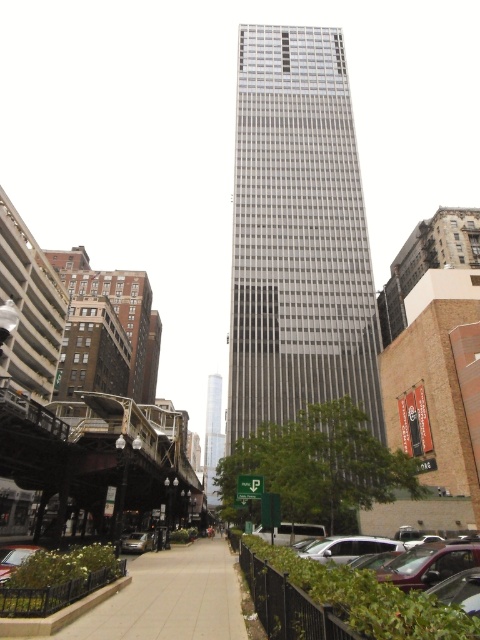
Question: Which object appears farthest from the camera in this image?

Choices:
 (A) silver glass skyscraper at center
 (B) smooth concrete sidewalk at center

Answer: (A)

Question: Is metallic silver car at center behind metallic silver car at lower right?

Choices:
 (A) yes
 (B) no

Answer: (A)

Question: Can you confirm if smooth concrete sidewalk at center is wider than matte silver car at lower left?

Choices:
 (A) no
 (B) yes

Answer: (B)

Question: Among these objects, which one is nearest to the camera?

Choices:
 (A) metallic silver car at center
 (B) metallic silver car at lower left

Answer: (B)

Question: Is smooth concrete sidewalk at center wider than matte purple car at lower right?

Choices:
 (A) no
 (B) yes

Answer: (B)

Question: Among these points, which one is nearest to the camera?

Choices:
 (A) (207, 381)
 (B) (256, 93)
 (C) (149, 541)
 (D) (82, 604)

Answer: (D)